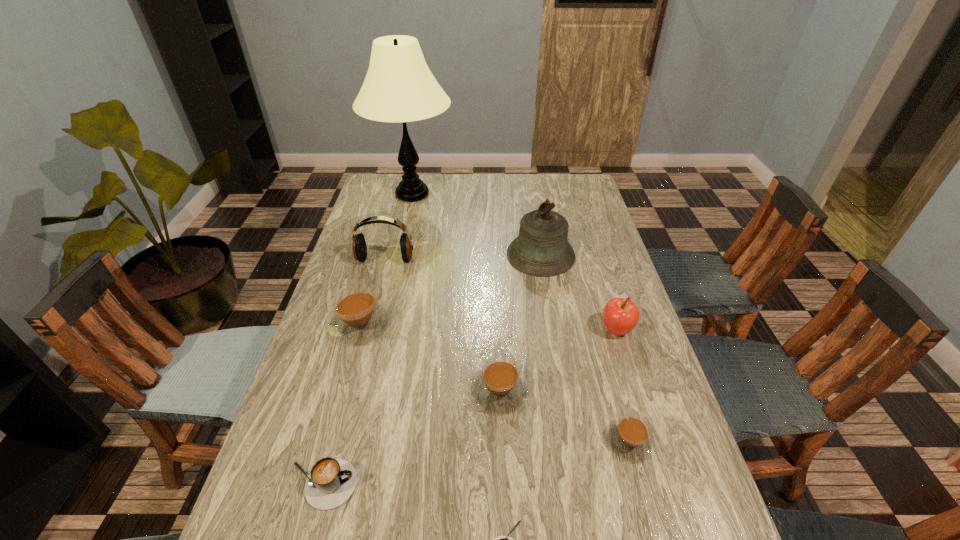
Identify the location of vacant area situated 0.120m with the handle on the side of the left black cappuccino. (415, 484).

The width and height of the screenshot is (960, 540). I want to click on vacant region located on the front of the nearest brown cappuccino, so click(650, 519).

The width and height of the screenshot is (960, 540). What are the coordinates of `object present at the far edge` in the screenshot? It's located at (399, 87).

Where is `lamp at the left edge`? lamp at the left edge is located at coordinates (399, 87).

Where is `headset that is at the left edge`? This screenshot has height=540, width=960. headset that is at the left edge is located at coordinates (359, 247).

Where is `bell that is at the right edge`? Image resolution: width=960 pixels, height=540 pixels. bell that is at the right edge is located at coordinates (541, 249).

The image size is (960, 540). I want to click on apple that is at the right edge, so click(620, 315).

Where is `cappuccino positioned at the right edge`? This screenshot has width=960, height=540. cappuccino positioned at the right edge is located at coordinates (629, 437).

The width and height of the screenshot is (960, 540). I want to click on object that is at the far left corner, so click(399, 87).

Where is `vacant region at the far edge`? The image size is (960, 540). vacant region at the far edge is located at coordinates pyautogui.click(x=515, y=174).